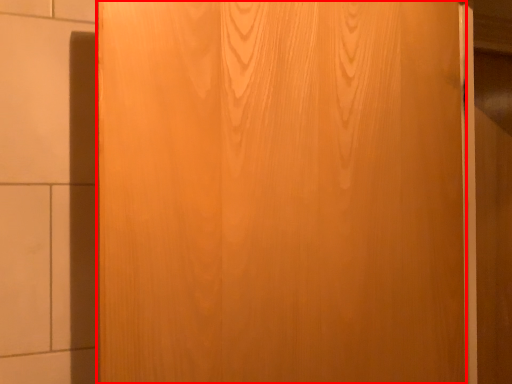
Question: From the image's perspective, what is the correct spatial relationship of door (annotated by the red box) in relation to barn door?

Choices:
 (A) above
 (B) below

Answer: (A)